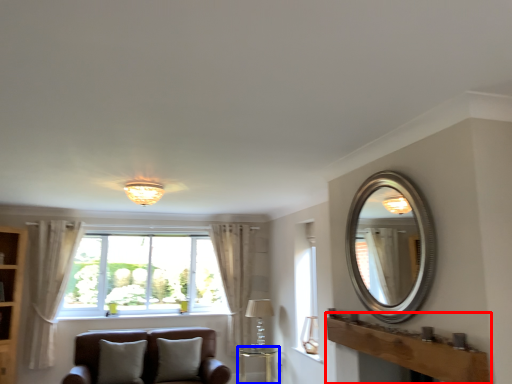
Question: Which object is closer to the camera taking this photo, mantle (highlighted by a red box) or table (highlighted by a blue box)?

Choices:
 (A) mantle
 (B) table

Answer: (A)